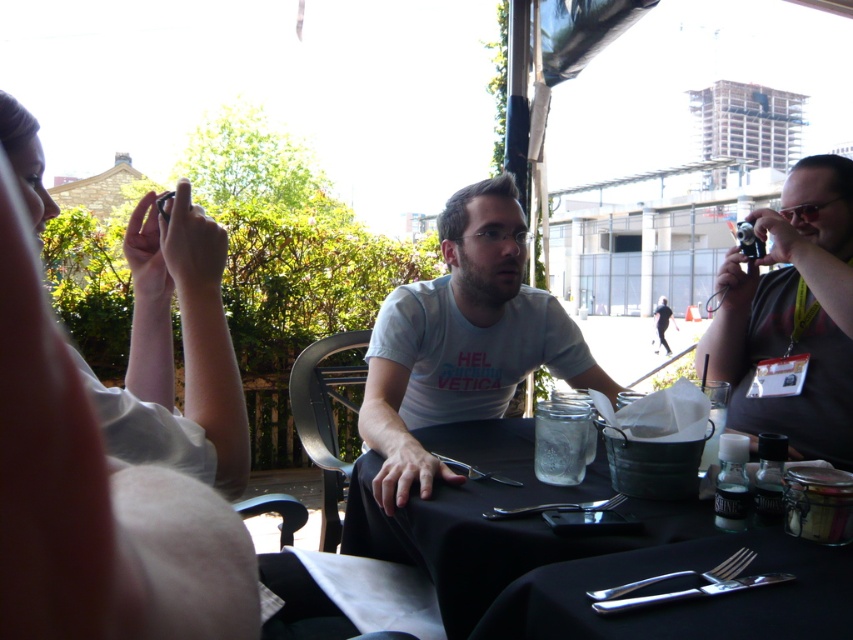
Question: Which point is farther to the camera?

Choices:
 (A) matte black camera at right
 (B) white cotton shirt at center
 (C) black matte table at center

Answer: (A)

Question: Where is white cotton shirt at center located in relation to matte black camera at right in the image?

Choices:
 (A) above
 (B) below

Answer: (B)

Question: Is the position of white cotton shirt at center less distant than that of matte black camera at right?

Choices:
 (A) no
 (B) yes

Answer: (B)

Question: Which point is farther from the camera taking this photo?

Choices:
 (A) (851, 547)
 (B) (428, 412)
 (C) (749, 291)

Answer: (B)

Question: Which of these objects is positioned closest to the matte black camera at right?

Choices:
 (A) white cotton shirt at center
 (B) black matte table at center

Answer: (A)

Question: Where is black matte table at center located in relation to matte black camera at right in the image?

Choices:
 (A) above
 (B) below

Answer: (B)